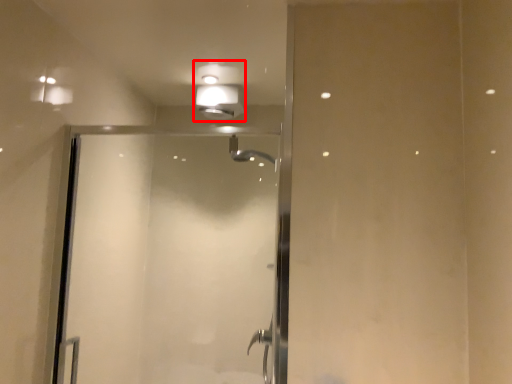
Question: From the image's perspective, what is the correct spatial relationship of light fixture (annotated by the red box) in relation to screen door?

Choices:
 (A) below
 (B) above

Answer: (B)